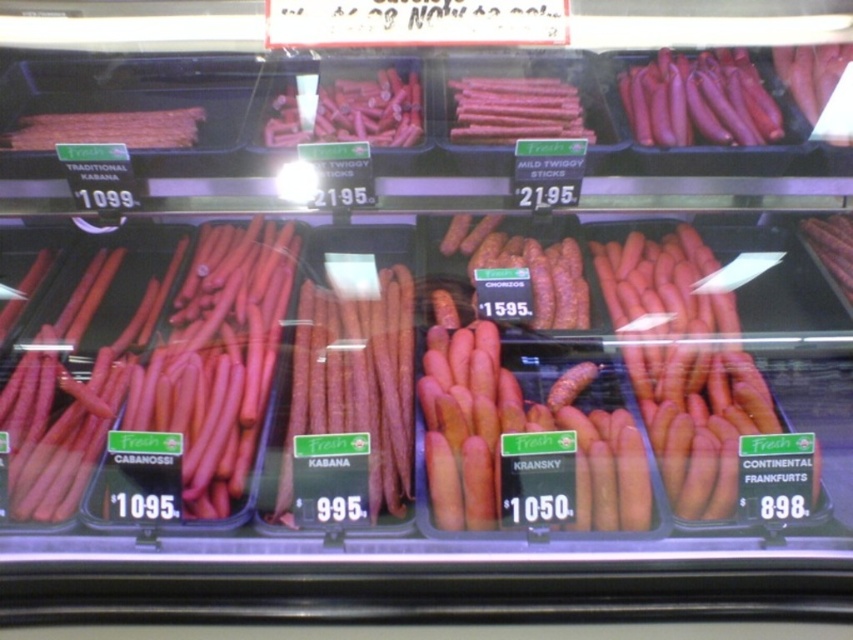
Which of these two, pink glossy sausages at upper right or smooth pink stick at center, stands taller?

Standing taller between the two is pink glossy sausages at upper right.

Is point (682, 58) closer to camera compared to point (543, 125)?

No, (682, 58) is behind (543, 125).

You are a GUI agent. You are given a task and a screenshot of the screen. Output one action in this format:
    pyautogui.click(x=<x>, y=<y>)
    Task: Click on the pink glossy sausages at upper right
    This screenshot has height=640, width=853.
    Given the screenshot: What is the action you would take?
    pyautogui.click(x=699, y=100)

Can you confirm if smooth pink stick at center is positioned below matte brown kabanossi at upper left?

No.

Can you confirm if smooth pink stick at center is smaller than matte brown kabanossi at upper left?

Correct, smooth pink stick at center occupies less space than matte brown kabanossi at upper left.

Which is behind, point (521, 131) or point (181, 140)?

Positioned behind is point (181, 140).

The height and width of the screenshot is (640, 853). I want to click on smooth pink stick at center, so click(x=515, y=109).

Is point (341, 93) behind point (567, 134)?

Yes.

Does matte pink stick at center have a lesser width compared to smooth pink stick at center?

Incorrect, matte pink stick at center's width is not less than smooth pink stick at center's.

Who is more forward, (387,90) or (456,106)?

Positioned in front is point (456,106).

Where is `matte pink stick at center`? matte pink stick at center is located at coordinates (351, 113).